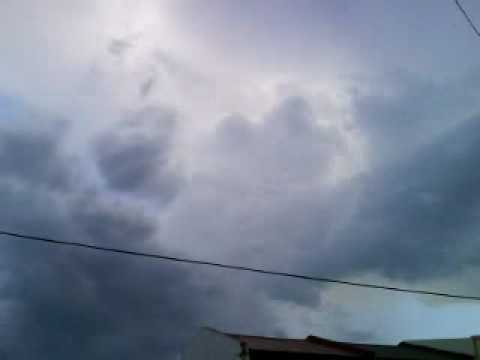
The width and height of the screenshot is (480, 360). I want to click on wall, so click(x=213, y=348).